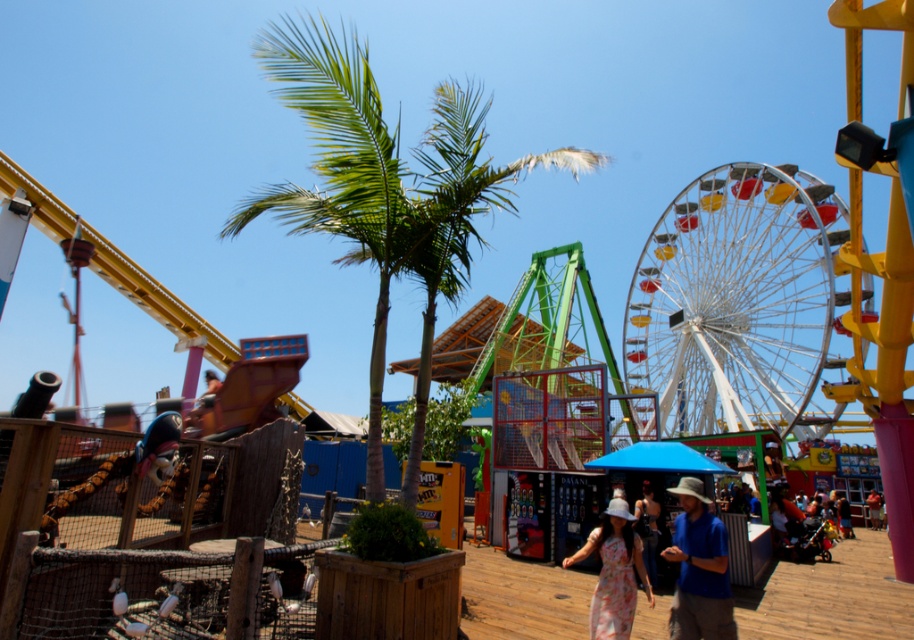
You are standing on the wooden walkway in the amusement park and want to go to the blue denim shorts at center. Which direction should you turn to face the metallic ferris wheel at right?

The metallic ferris wheel at right is to the left of blue denim shorts at center, so to face it, you should turn to your left.

You are standing on the wooden walkway in the amusement park and see two points marked in the scene. Which point, point (711, 170) or point (707, 520), is closer to you?

Point (711, 170) is further to the camera than point (707, 520), so the point closer to you is point (707, 520).

You are planning to take a photo of the metallic ferris wheel at right from the position of the blue cotton shirt at center. Given that the recommended minimum distance for clear photography is 120 feet, will you be able to capture a clear image?

The distance between the metallic ferris wheel at right and the blue cotton shirt at center is 134.10 feet, which exceeds the recommended 120 feet minimum distance. Therefore, you can capture a clear image from that position.